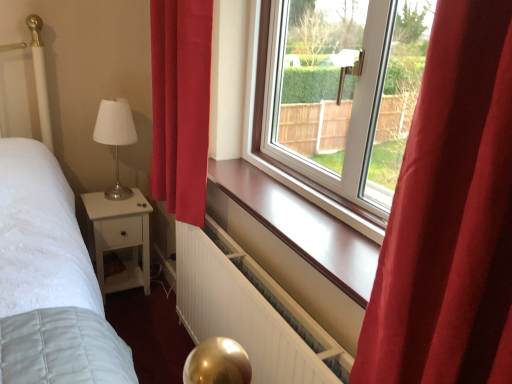
Question: Does white satin table lamp at left have a lesser height compared to red velvet curtain at left?

Choices:
 (A) no
 (B) yes

Answer: (B)

Question: Does white satin table lamp at left have a smaller size compared to red velvet curtain at left?

Choices:
 (A) no
 (B) yes

Answer: (B)

Question: Is white satin table lamp at left outside of red velvet curtain at left?

Choices:
 (A) no
 (B) yes

Answer: (B)

Question: Is white satin table lamp at left to the left of red velvet curtain at left from the viewer's perspective?

Choices:
 (A) no
 (B) yes

Answer: (B)

Question: Is there a large distance between white satin table lamp at left and red velvet curtain at left?

Choices:
 (A) no
 (B) yes

Answer: (A)

Question: From the image's perspective, is white satin table lamp at left located above or below white matte nightstand at lower left?

Choices:
 (A) above
 (B) below

Answer: (A)

Question: Based on their positions, is white satin table lamp at left located to the left or right of white matte nightstand at lower left?

Choices:
 (A) right
 (B) left

Answer: (A)

Question: From a real-world perspective, is white satin table lamp at left above or below white matte nightstand at lower left?

Choices:
 (A) above
 (B) below

Answer: (A)

Question: Looking at their shapes, would you say white satin table lamp at left is wider or thinner than white matte nightstand at lower left?

Choices:
 (A) wide
 (B) thin

Answer: (B)

Question: From a real-world perspective, is red velvet curtain at left positioned above or below white matte radiator at lower center?

Choices:
 (A) below
 (B) above

Answer: (B)

Question: Relative to white matte radiator at lower center, is red velvet curtain at left in front or behind?

Choices:
 (A) behind
 (B) front

Answer: (A)

Question: Considering the positions of red velvet curtain at left and white matte radiator at lower center in the image, is red velvet curtain at left taller or shorter than white matte radiator at lower center?

Choices:
 (A) short
 (B) tall

Answer: (B)

Question: Does point (206, 82) appear closer or farther from the camera than point (276, 375)?

Choices:
 (A) farther
 (B) closer

Answer: (A)

Question: From the image's perspective, relative to white matte radiator at lower center, is white satin table lamp at left above or below?

Choices:
 (A) above
 (B) below

Answer: (A)

Question: In terms of size, does white satin table lamp at left appear bigger or smaller than white matte radiator at lower center?

Choices:
 (A) big
 (B) small

Answer: (B)